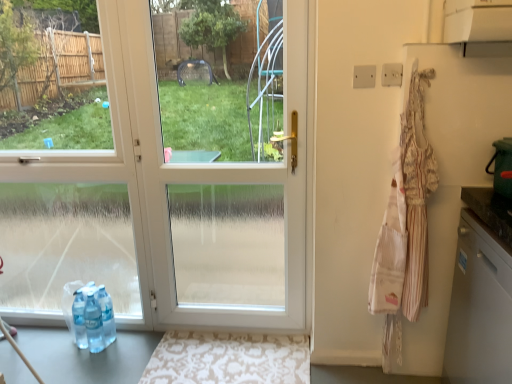
Question: Does striped cotton apron at right have a lesser height compared to white glossy door at center?

Choices:
 (A) no
 (B) yes

Answer: (B)

Question: Considering the relative sizes of striped cotton apron at right and white glossy door at center in the image provided, is striped cotton apron at right smaller than white glossy door at center?

Choices:
 (A) no
 (B) yes

Answer: (B)

Question: From a real-world perspective, is striped cotton apron at right physically above white glossy door at center?

Choices:
 (A) yes
 (B) no

Answer: (B)

Question: Can you confirm if striped cotton apron at right is positioned to the right of white glossy door at center?

Choices:
 (A) yes
 (B) no

Answer: (A)

Question: Is striped cotton apron at right in front of white glossy door at center?

Choices:
 (A) yes
 (B) no

Answer: (A)

Question: In the image, is white glossy dishwasher at right positioned in front of or behind beige damask rug at lower center?

Choices:
 (A) front
 (B) behind

Answer: (A)

Question: From a real-world perspective, is white glossy dishwasher at right above or below beige damask rug at lower center?

Choices:
 (A) above
 (B) below

Answer: (A)

Question: Is point (502, 347) closer or farther from the camera than point (192, 365)?

Choices:
 (A) closer
 (B) farther

Answer: (A)

Question: From their relative heights in the image, would you say white glossy dishwasher at right is taller or shorter than beige damask rug at lower center?

Choices:
 (A) tall
 (B) short

Answer: (A)

Question: Do you think white glossy dishwasher at right is within striped cotton apron at right, or outside of it?

Choices:
 (A) outside
 (B) inside

Answer: (A)

Question: From a real-world perspective, is white glossy dishwasher at right physically located above or below striped cotton apron at right?

Choices:
 (A) below
 (B) above

Answer: (A)

Question: Is white glossy dishwasher at right bigger or smaller than striped cotton apron at right?

Choices:
 (A) big
 (B) small

Answer: (A)

Question: From the image's perspective, is white glossy dishwasher at right positioned above or below striped cotton apron at right?

Choices:
 (A) below
 (B) above

Answer: (A)

Question: Would you say beige damask rug at lower center is to the left or to the right of white glossy dishwasher at right in the picture?

Choices:
 (A) right
 (B) left

Answer: (B)

Question: From a real-world perspective, is beige damask rug at lower center positioned above or below white glossy dishwasher at right?

Choices:
 (A) above
 (B) below

Answer: (B)